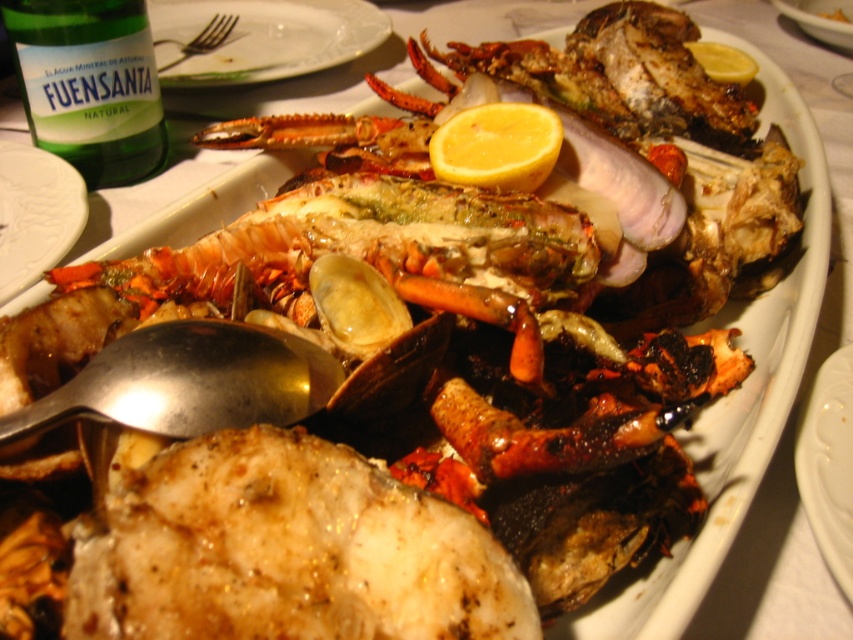
You are a photographer trying to capture the perfect shot of the seafood platter. You notice two points on the platter, one at point coordinates point (123, 44) and another at point coordinates point (164, 86). Which point should you focus on to ensure it appears sharper in the photo?

Point (123, 44) should be focused on because it is closer to the camera than point (164, 86), so it will appear sharper in the photo.

You are a food critic evaluating this seafood platter. The white glossy plate at center is located at point (828, 464). Where would you place your utensils relative to this point to ensure they are on the table but not on the plate itself?

The utensils should be placed on the table near the white glossy plate at center but not overlapping its position at point (828, 464). Since the plate is at that exact coordinate, placing utensils slightly to the side or edge of the plate would keep them on the table and away from the plate itself.

From the picture: You are a server at a restaurant and need to place a 12 inch long bottle of olive oil between the green glass bottle at upper left and the matte white plate at upper left. Is there enough space to fit it without moving either object?

The distance between the green glass bottle at upper left and the matte white plate at upper left is 17.63 inches. Since the bottle is 12 inches long, there is enough space to place it between them without moving either object.